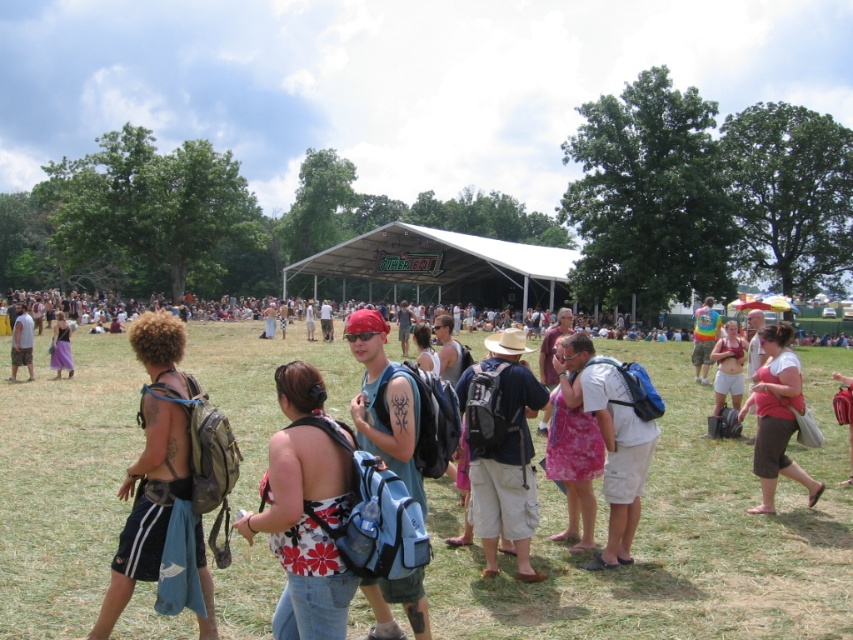
You are at the festival and see both the dark blue backpack at center and the pink fabric dress at center. Which object is positioned higher from the ground?

The dark blue backpack at center is above the pink fabric dress at center, so it is positioned higher from the ground.

You are standing at the festival and want to take a photo of the point at coordinates (128, 572). If your camera has a maximum focus range of 15 feet, will it be able to focus on that point?

The distance of point (128, 572) from the camera is 15.24 feet, which exceeds the camera maximum focus range of 15 feet. Therefore, the camera cannot focus on that point.